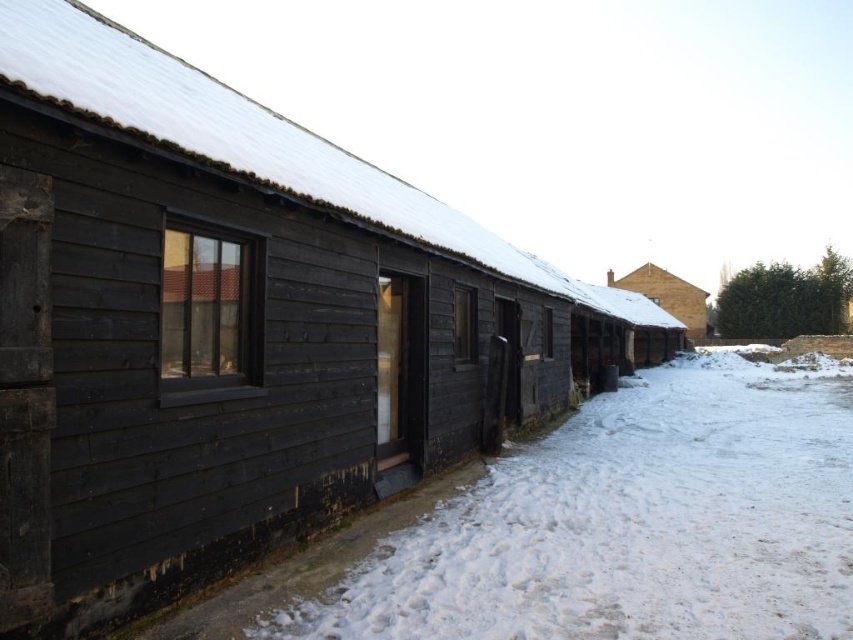
Is point (670, 566) positioned before point (643, 275)?

Yes, point (670, 566) is closer to viewer.

Between white powdery snow at lower center and brown textured brick hut at center, which one is positioned lower?

white powdery snow at lower center is lower down.

Is point (509, 547) less distant than point (648, 291)?

Yes, it is.

This screenshot has width=853, height=640. In order to click on white powdery snow at lower center in this screenshot , I will do `click(634, 522)`.